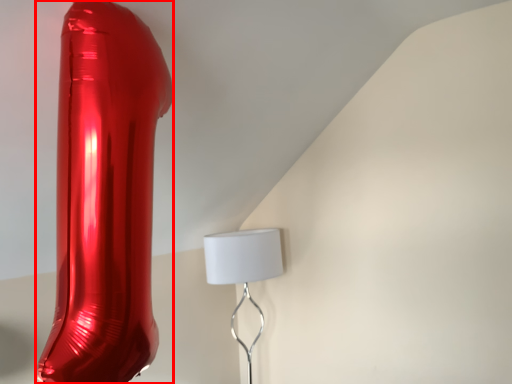
Question: From the image's perspective, what is the correct spatial positioning of glass vase (annotated by the red box) in reference to lamp?

Choices:
 (A) below
 (B) above

Answer: (B)